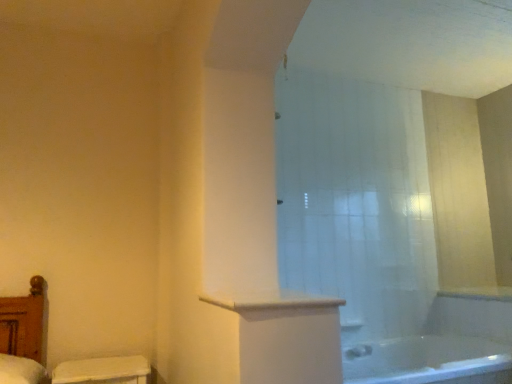
This screenshot has width=512, height=384. Describe the element at coordinates (267, 299) in the screenshot. I see `white glossy counter top at center` at that location.

The image size is (512, 384). In order to click on white glossy counter top at center in this screenshot , I will do `click(267, 299)`.

At what (x,y) coordinates should I click in order to perform the action: click on white glossy counter top at center. Please return your answer as a coordinate pair (x, y). This screenshot has height=384, width=512. Looking at the image, I should click on (267, 299).